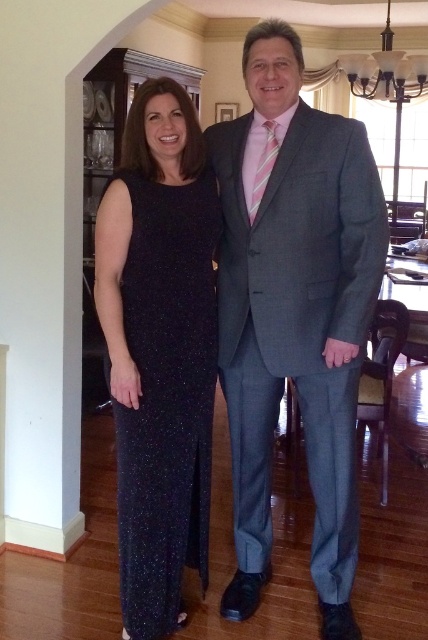
What do you see at coordinates (294, 314) in the screenshot? I see `gray wool suit at center` at bounding box center [294, 314].

Is gray wool suit at center behind sparkly dark blue dress at center?

That is False.

Where is `gray wool suit at center`? Image resolution: width=428 pixels, height=640 pixels. gray wool suit at center is located at coordinates (294, 314).

Locate an element on the screen. gray wool suit at center is located at coordinates (294, 314).

Between point (157, 378) and point (262, 152), which one is positioned in front?

Point (157, 378) is more forward.

Is sparkly dark blue dress at center smaller than pink striped tie at center?

Actually, sparkly dark blue dress at center might be larger than pink striped tie at center.

Between point (171, 620) and point (261, 172), which one is positioned in front?

Positioned in front is point (261, 172).

Locate an element on the screen. The image size is (428, 640). sparkly dark blue dress at center is located at coordinates (166, 397).

Who is positioned more to the right, gray wool suit at center or pink striped tie at center?

From the viewer's perspective, gray wool suit at center appears more on the right side.

Measure the distance from gray wool suit at center to pink striped tie at center.

gray wool suit at center is 18.15 inches from pink striped tie at center.

Describe the element at coordinates (294, 314) in the screenshot. I see `gray wool suit at center` at that location.

I want to click on gray wool suit at center, so click(x=294, y=314).